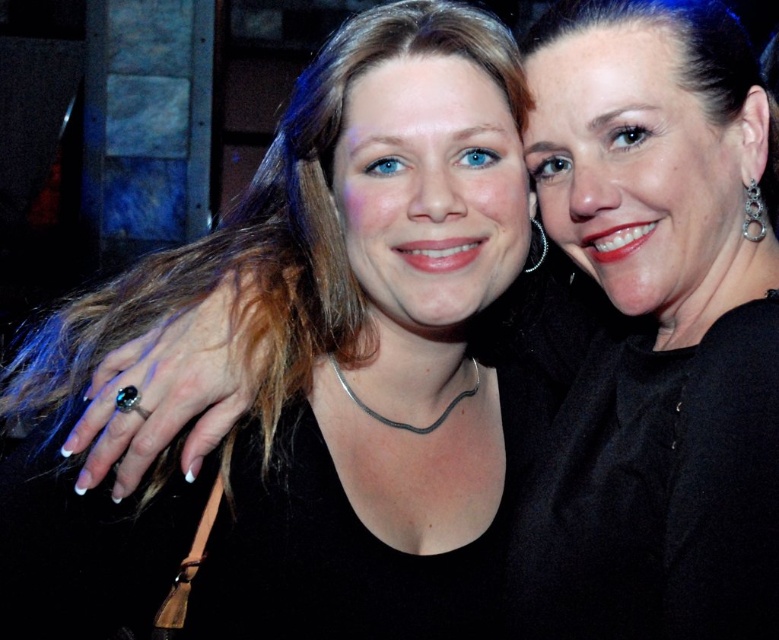
Does point (298, 230) come farther from viewer compared to point (570, 413)?

Yes, it is.

Is black matte necklace at center smaller than black matte dress at center?

Actually, black matte necklace at center might be larger than black matte dress at center.

Which is behind, point (386, 404) or point (776, 275)?

Point (386, 404)

Locate an element on the screen. black matte necklace at center is located at coordinates (319, 372).